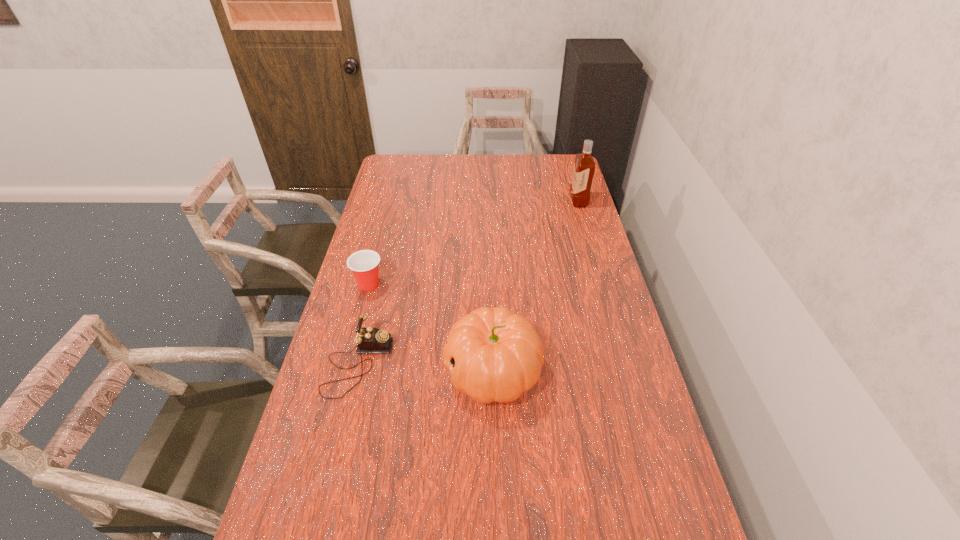
Locate an element on the screen. This screenshot has width=960, height=540. vacant area that lies between the rightmost object and the third object from left to right is located at coordinates (536, 286).

Image resolution: width=960 pixels, height=540 pixels. I want to click on vacant area between the telephone and the tallest object, so click(x=468, y=283).

Locate an element on the screen. free area in between the farthest object and the third shortest object is located at coordinates (536, 286).

The width and height of the screenshot is (960, 540). I want to click on empty space that is in between the telephone and the tallest object, so click(468, 283).

Locate an element on the screen. This screenshot has width=960, height=540. free space between the pumpkin and the tallest object is located at coordinates (536, 286).

At what (x,y) coordinates should I click in order to perform the action: click on vacant point located between the telephone and the liquor. Please return your answer as a coordinate pair (x, y). The width and height of the screenshot is (960, 540). Looking at the image, I should click on (468, 283).

The height and width of the screenshot is (540, 960). I want to click on free spot between the second tallest object and the telephone, so click(x=425, y=367).

Where is `free space that is in between the farthest object and the second farthest object`? free space that is in between the farthest object and the second farthest object is located at coordinates (473, 243).

Identify the location of unoccupied area between the farthest object and the telephone. (468, 283).

What are the coordinates of `vacant space that's between the telephone and the second tallest object` in the screenshot? It's located at (425, 367).